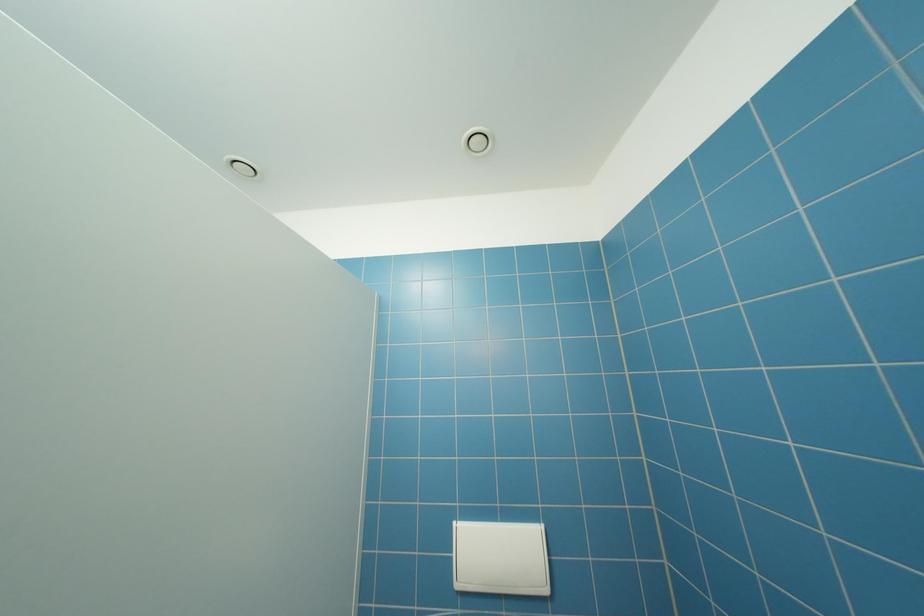
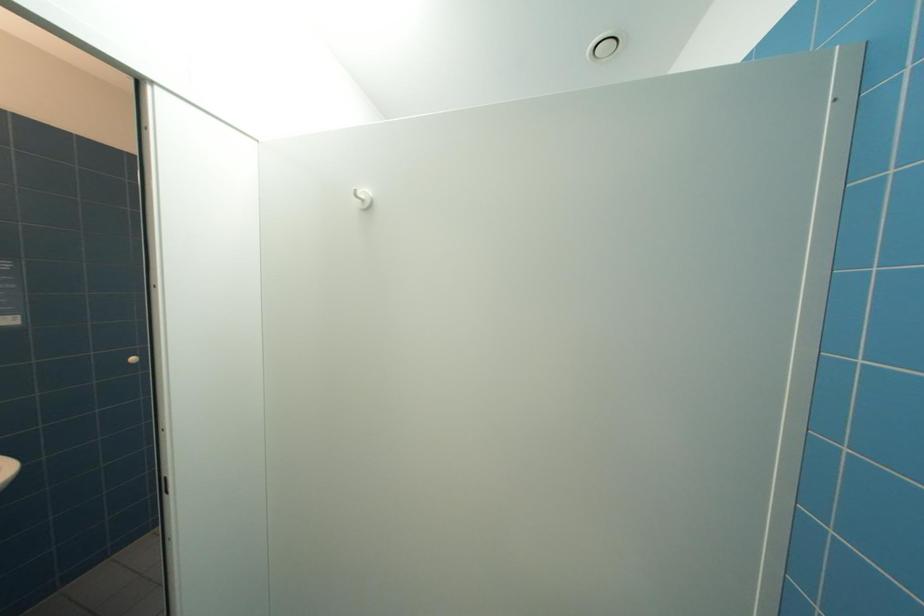
Question: The first image is from the beginning of the video and the second image is from the end. How did the camera likely rotate when shooting the video?

Choices:
 (A) Left
 (B) Right
 (C) Up
 (D) Down

Answer: (A)